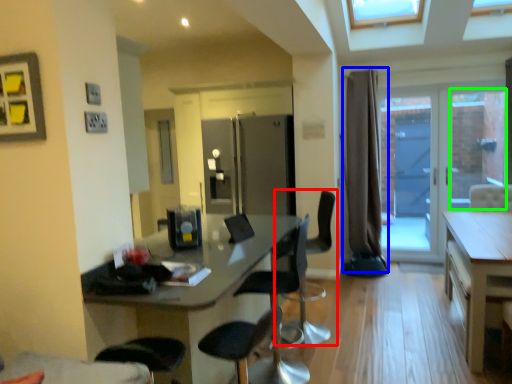
Question: Based on their relative distances, which object is farther from chair (highlighted by a red box)? Choose from curtain (highlighted by a blue box) and window (highlighted by a green box).

Choices:
 (A) curtain
 (B) window

Answer: (B)